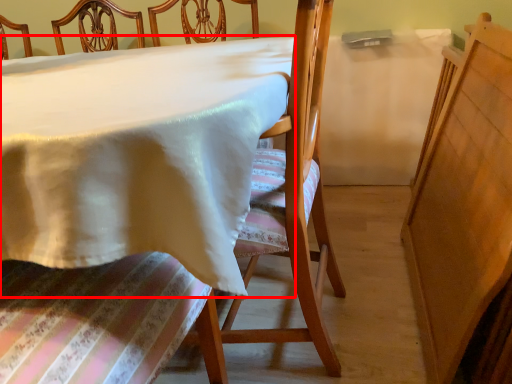
Question: From the image's perspective, where is table (annotated by the red box) located in relation to chair in the image?

Choices:
 (A) below
 (B) above

Answer: (A)